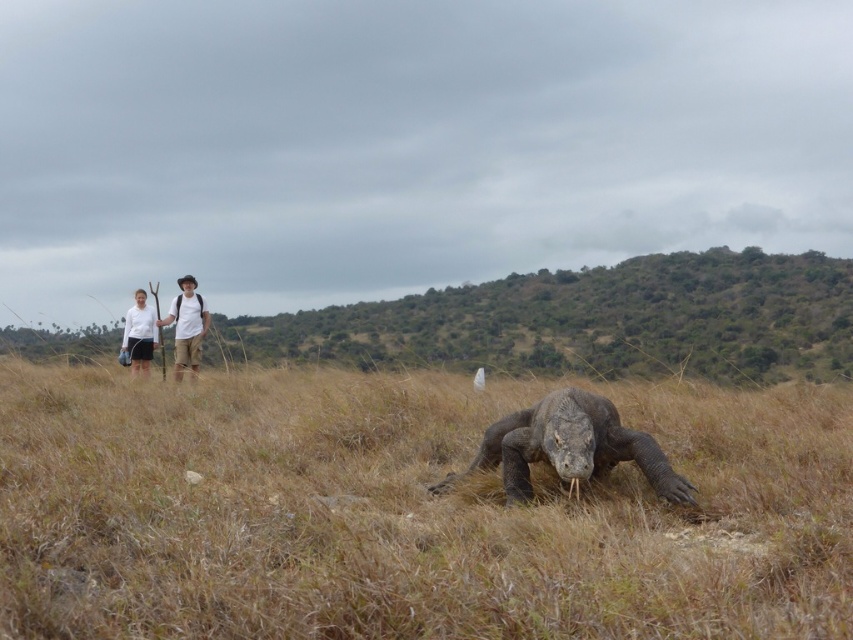
Question: Among these objects, which one is nearest to the camera?

Choices:
 (A) gray rough skin at center
 (B) brown dry grass at center
 (C) white matte shirt at left

Answer: (B)

Question: Considering the relative positions of white cotton shirt at center and white matte shirt at left in the image provided, where is white cotton shirt at center located with respect to white matte shirt at left?

Choices:
 (A) left
 (B) right

Answer: (B)

Question: Does gray rough skin at center lie in front of white matte shirt at left?

Choices:
 (A) no
 (B) yes

Answer: (B)

Question: Is brown dry grass at center positioned before white matte shirt at left?

Choices:
 (A) yes
 (B) no

Answer: (A)

Question: Which point is farther from the camera taking this photo?

Choices:
 (A) (177, 308)
 (B) (532, 419)
 (C) (105, 544)
 (D) (146, 320)

Answer: (D)

Question: Estimate the real-world distances between objects in this image. Which object is closer to the gray rough skin at center?

Choices:
 (A) brown dry grass at center
 (B) white cotton shirt at center
 (C) white matte shirt at left

Answer: (A)